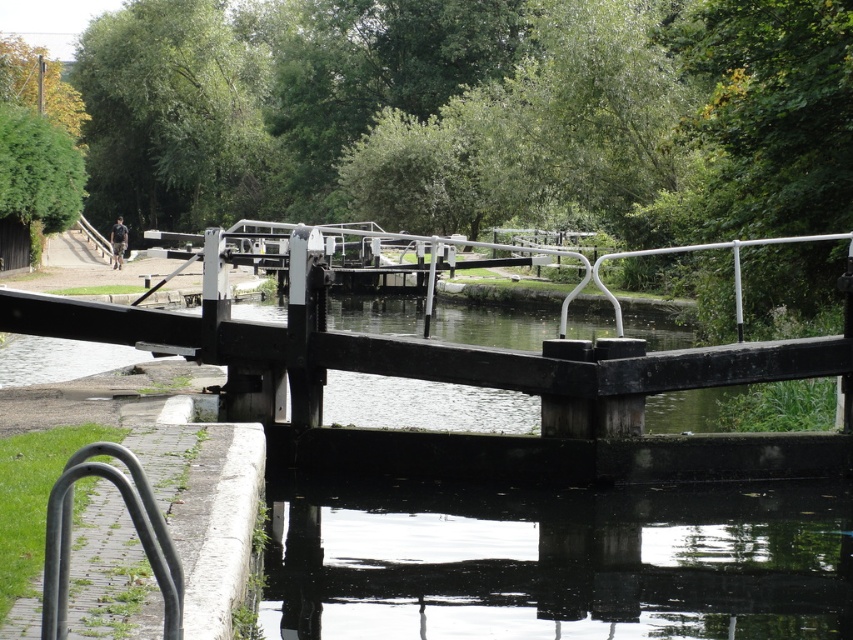
You are a boat captain navigating a narrow canal. Your boat is 4 meters long. You see the transparent water at center and the smooth white rail at center. Can your boat safely pass through the space between them without touching either?

The transparent water at center is 3.91 meters away from the smooth white rail at center. Since your boat is 4 meters long, it is slightly longer than the available space. Therefore, your boat cannot safely pass through the space between them without touching either.

You are a cyclist who just arrived at the canal and see the transparent water at center and the black metal bike rack at lower left. Where should you lock your bike to ensure it stays secure and visible? Please choose between the two options provided.

You should lock your bike to the black metal bike rack at lower left because it is designed for securing bikes, while the transparent water at center is not a suitable or safe option for bike locking.